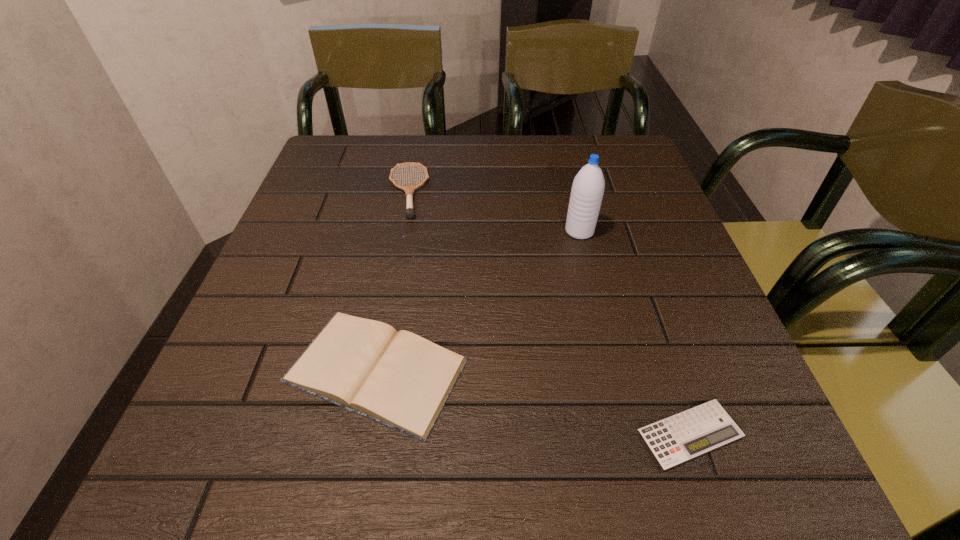
I want to click on free spot between the calculator and the third nearest object, so click(x=635, y=333).

The width and height of the screenshot is (960, 540). Find the location of `object that is the third closest to the tennis racket`. object that is the third closest to the tennis racket is located at coordinates (677, 439).

Identify which object is the third closest to the water bottle. Please provide its 2D coordinates. Your answer should be formatted as a tuple, i.e. [(x, y)], where the tuple contains the x and y coordinates of a point satisfying the conditions above.

[(677, 439)]

The width and height of the screenshot is (960, 540). Identify the location of free spot that satisfies the following two spatial constraints: 1. on the front side of the second farthest object; 2. on the right side of the farthest object. (400, 232).

You are a GUI agent. You are given a task and a screenshot of the screen. Output one action in this format:
    pyautogui.click(x=<x>, y=<y>)
    Task: Click on the free space that satisfies the following two spatial constraints: 1. on the front side of the tennis racket; 2. on the left side of the second farthest object
    
    Given the screenshot: What is the action you would take?
    pyautogui.click(x=400, y=232)

You are a GUI agent. You are given a task and a screenshot of the screen. Output one action in this format:
    pyautogui.click(x=<x>, y=<y>)
    Task: Click on the free point that satisfies the following two spatial constraints: 1. on the front side of the water bottle; 2. on the right side of the calculator
    
    Given the screenshot: What is the action you would take?
    pyautogui.click(x=628, y=434)

Locate an element on the screen. The width and height of the screenshot is (960, 540). vacant space that satisfies the following two spatial constraints: 1. on the front side of the calculator; 2. on the left side of the tallest object is located at coordinates (628, 434).

Identify the location of free space that satisfies the following two spatial constraints: 1. on the front side of the third nearest object; 2. on the left side of the calculator. Image resolution: width=960 pixels, height=540 pixels. (628, 434).